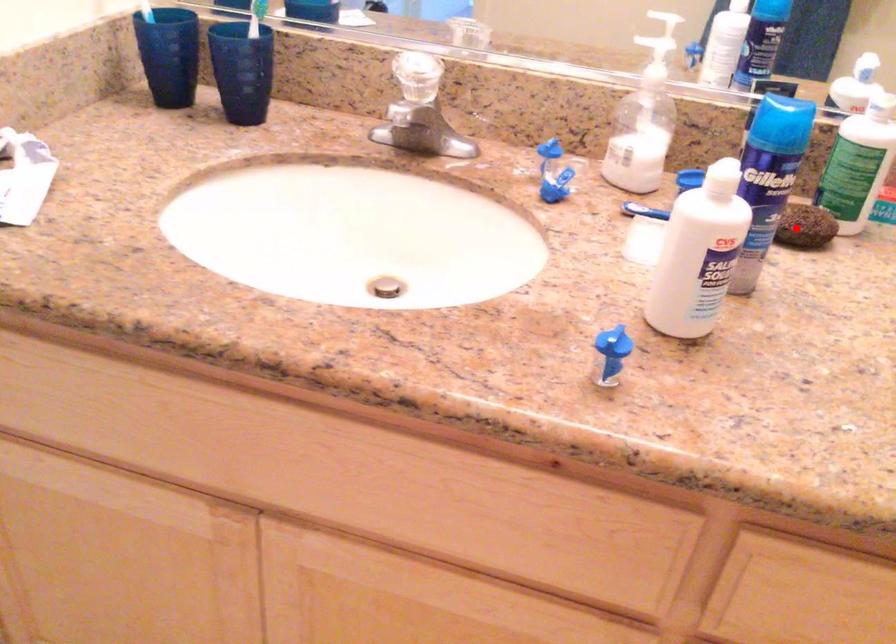
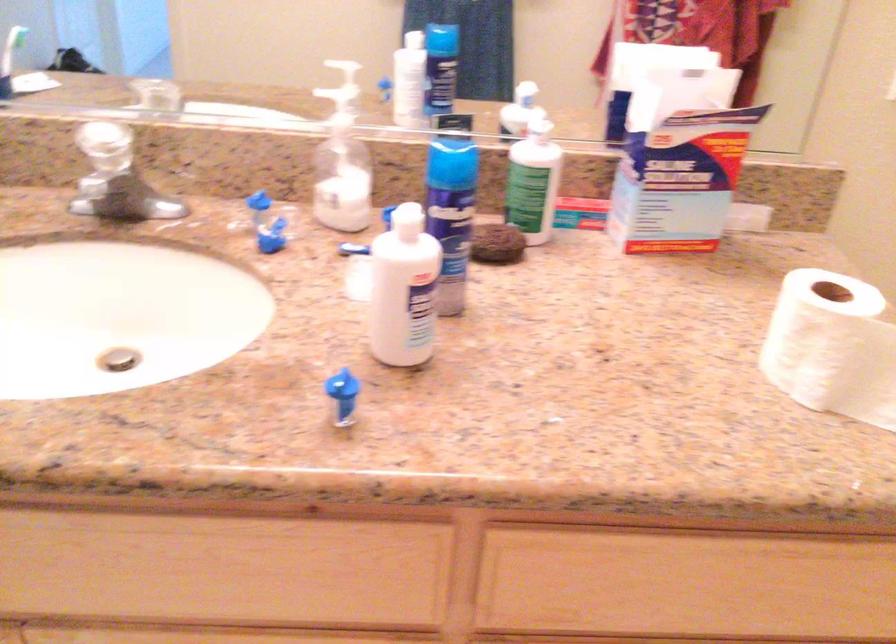
Question: I am providing you with two images of the same scene from different viewpoints. Image1 has a red point marked. In image2, the corresponding 3D location appears at what relative position? Reply with the corresponding letter.

Choices:
 (A) Closer
 (B) Farther

Answer: (B)